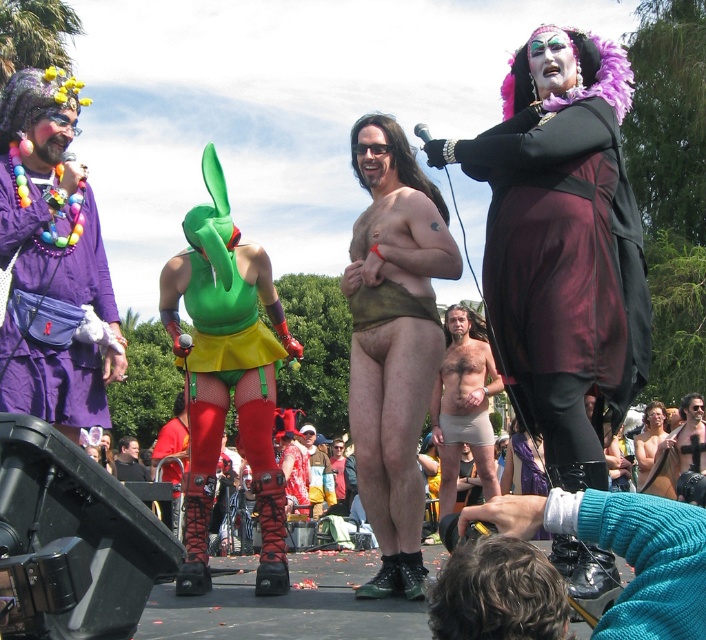
You are an event photographer who wants to capture the purple fabric fanny pack at left and the skinny beige shorts at center in the same frame. Based on their positions, which object should you focus on first to ensure both are in the shot?

Since the purple fabric fanny pack at left is to the left of the skinny beige shorts at center, you should focus on the purple fabric fanny pack at left first to ensure both are included in the frame.

You are a costume designer analyzing the performers on stage. You notice the purple fabric fanny pack at left and the skinny beige shorts at center. Which of these two items is shorter in height?

The purple fabric fanny pack at left has a lesser height compared to the skinny beige shorts at center, so the purple fabric fanny pack at left is shorter in height.

You are a costume designer observing the performers on stage. You need to determine which item is higher positioned between the brown leather shorts at center and the purple fabric fanny pack at left. Which one is taller?

The brown leather shorts at center is taller than the purple fabric fanny pack at left according to the description.